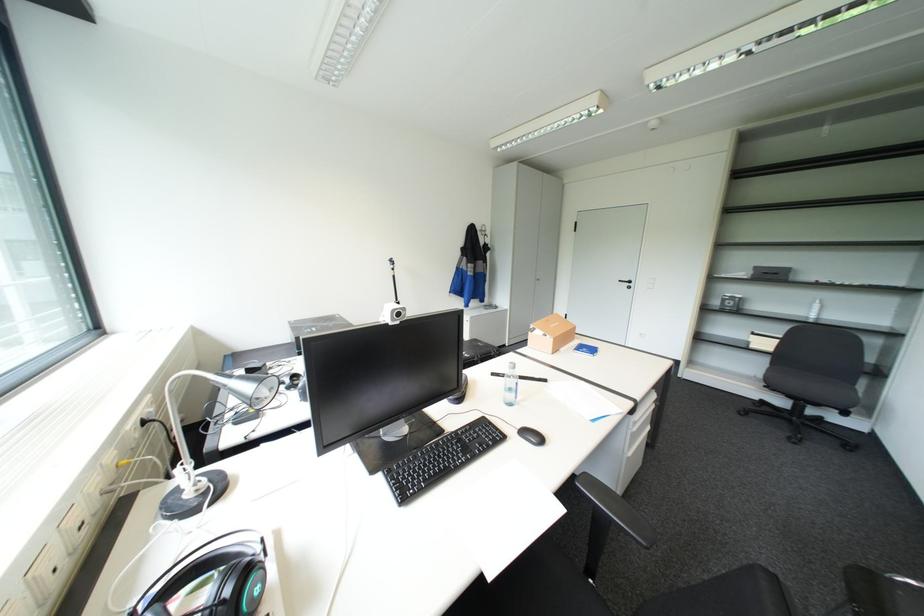
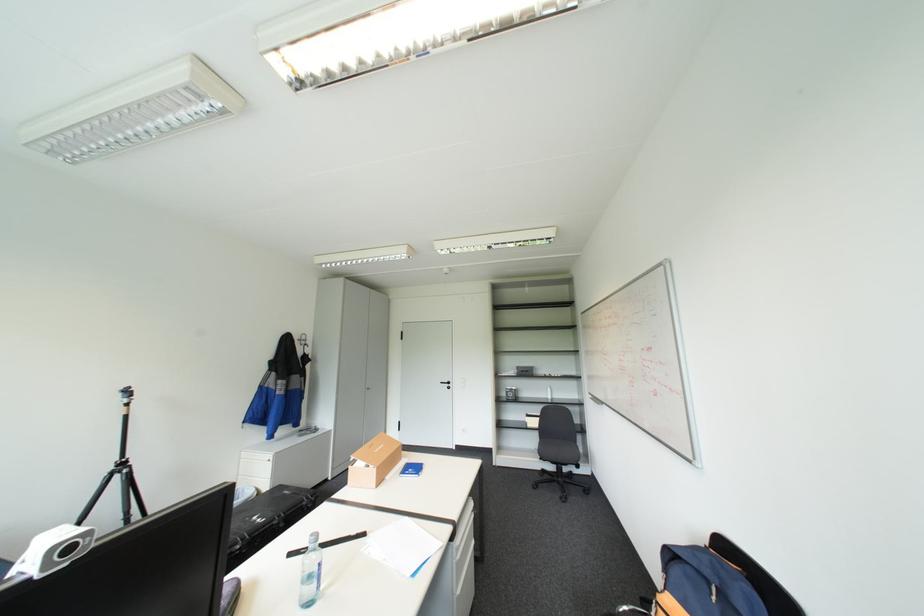
The point at (628,280) is marked in the first image. Where is the corresponding point in the second image?

(450, 381)